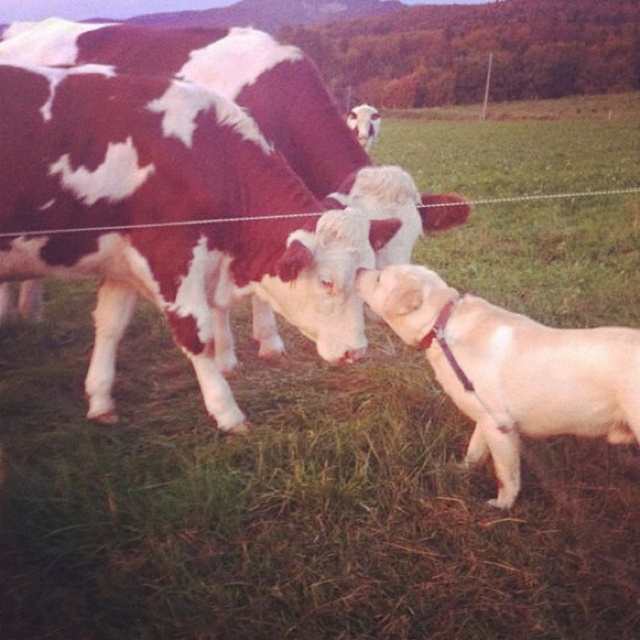
You are standing at the camera position and want to throw a ball to the smooth white dog at center. If the ball travels in a straight line, how far will it have to travel to reach the dog?

The distance between the smooth white dog at center and the camera is 9.13 feet, so the ball must travel 9.13 feet to reach the dog.

You are standing at the camera position and want to throw a ball to the light brown fur at right. If the ball travels in a straight line, how far will it have to travel?

The ball will have to travel 8.36 feet to reach the light brown fur at right.

You are standing in the grassy field and see the light brown fur at right. Where is it located in relation to the cow and calf?

The light brown fur at right is located at point (513, 369), which places it in the foreground near the dog, separate from the cow and calf positioned on the left side of the frame.